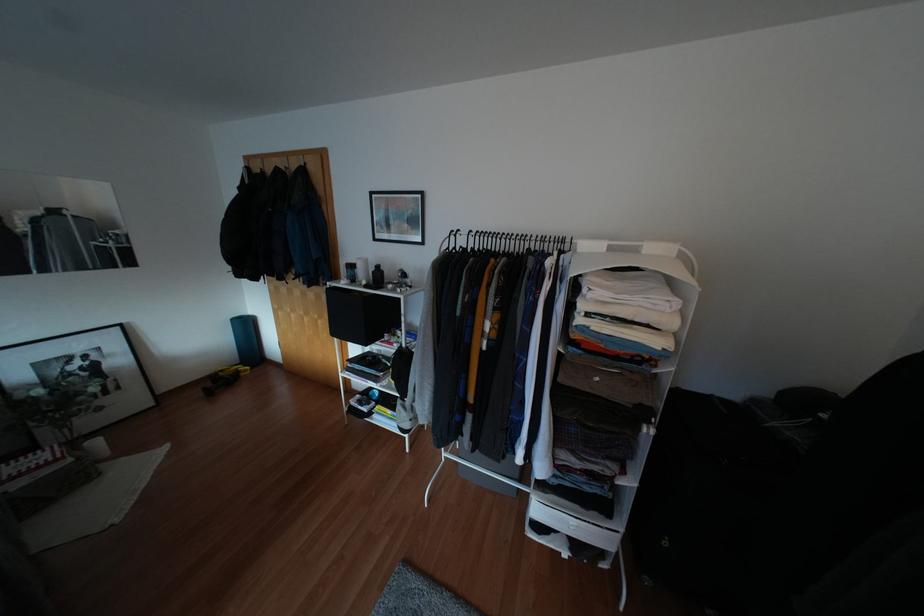
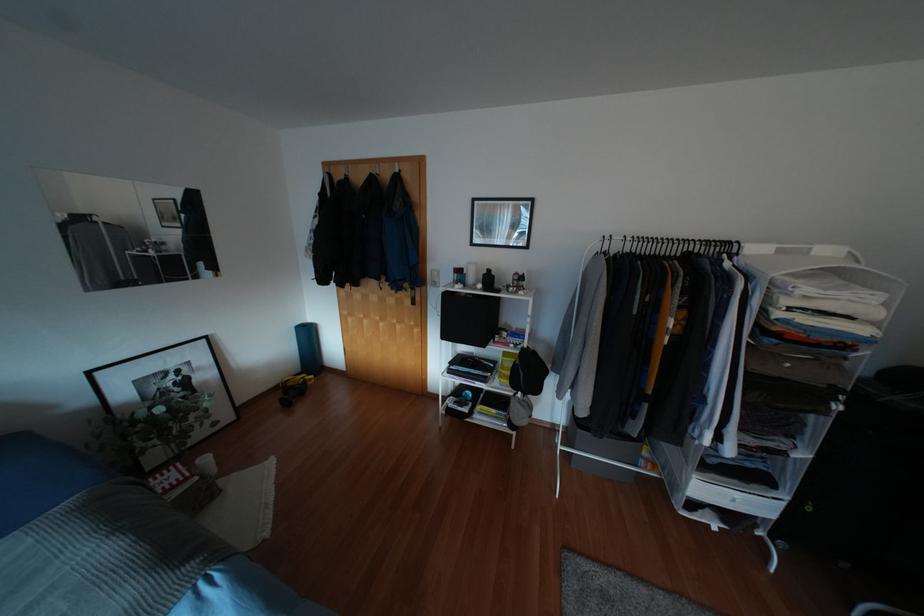
Locate, in the second image, the point that corresponds to point 610,248 in the first image.

(779, 251)